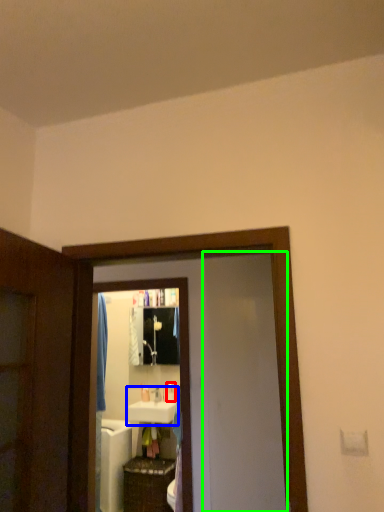
Question: Based on their relative distances, which object is farther from toiletry (highlighted by a red box)? Choose from sink (highlighted by a blue box) and screen door (highlighted by a green box).

Choices:
 (A) sink
 (B) screen door

Answer: (B)